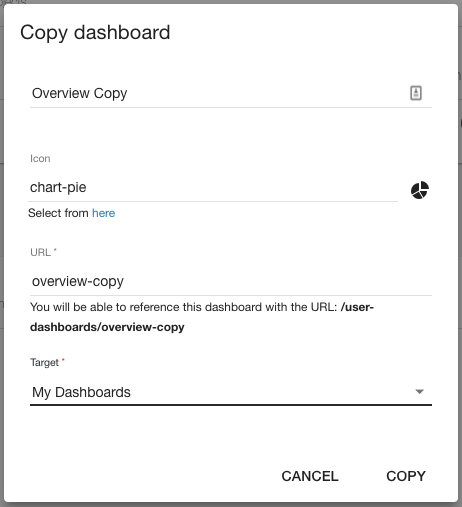
At what (x,y) coordinates should I click in order to perform the action: click on light gray section divider lines. Please return your answer as a coordinate pair (x, y). This screenshot has width=462, height=507. Looking at the image, I should click on (165, 107), (196, 202), (209, 293).